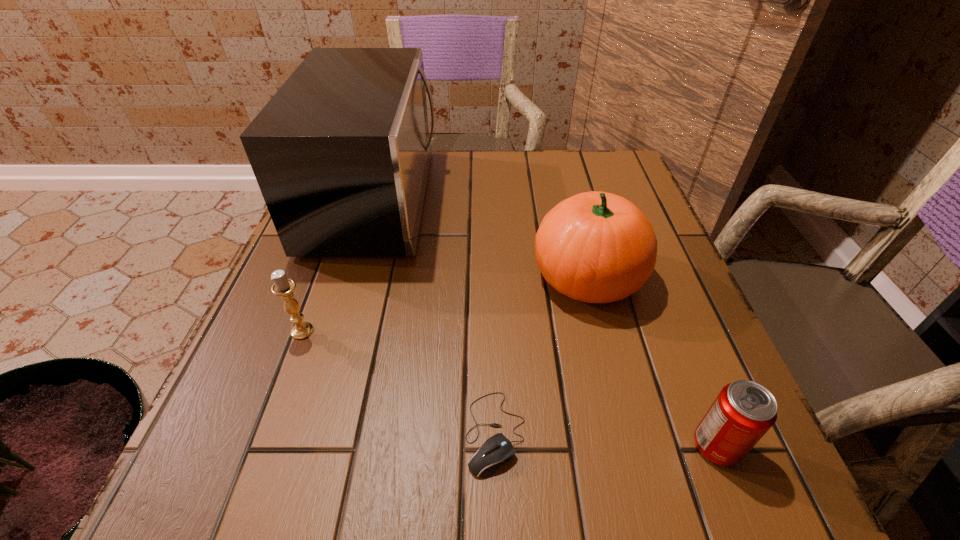
You are a GUI agent. You are given a task and a screenshot of the screen. Output one action in this format:
    pyautogui.click(x=<x>, y=<y>)
    Task: Click on the free space located on the back of the third object from right to left
    
    Given the screenshot: What is the action you would take?
    pyautogui.click(x=492, y=332)

This screenshot has width=960, height=540. Find the location of `object present at the far edge`. object present at the far edge is located at coordinates (341, 153).

Identify the location of soda can at the near edge. This screenshot has width=960, height=540. (743, 411).

Locate an element on the screen. Image resolution: width=960 pixels, height=540 pixels. computer mouse that is positioned at the near edge is located at coordinates (496, 450).

Identify the location of microwave oven that is at the left edge. (341, 153).

The width and height of the screenshot is (960, 540). I want to click on candle holder that is at the left edge, so click(x=283, y=286).

Locate an element on the screen. The width and height of the screenshot is (960, 540). pumpkin at the right edge is located at coordinates (596, 247).

Find the location of a particular element. The image size is (960, 540). soda can situated at the right edge is located at coordinates (743, 411).

Locate an element on the screen. The width and height of the screenshot is (960, 540). object that is at the far left corner is located at coordinates (341, 153).

Image resolution: width=960 pixels, height=540 pixels. I want to click on object positioned at the near right corner, so click(x=743, y=411).